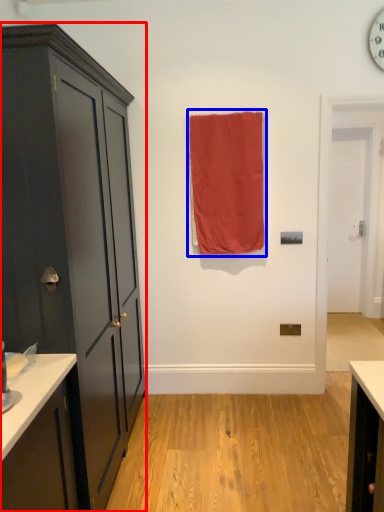
Question: Which of the following is the closest to the observer, cabinetry (highlighted by a red box) or curtain (highlighted by a blue box)?

Choices:
 (A) cabinetry
 (B) curtain

Answer: (A)